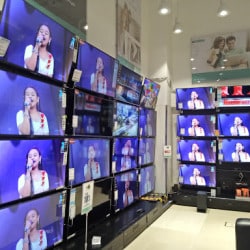
You are a GUI agent. You are given a task and a screenshot of the screen. Output one action in this format:
    pyautogui.click(x=<x>, y=<y>)
    Task: Click on the wall behind tv
    
    Given the screenshot: What is the action you would take?
    pyautogui.click(x=185, y=77), pyautogui.click(x=93, y=23)